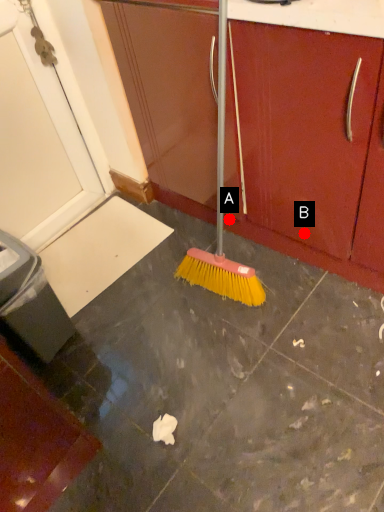
Question: Two points are circled on the image, labeled by A and B beside each circle. Which point is closer to the camera?

Choices:
 (A) A is closer
 (B) B is closer

Answer: (B)